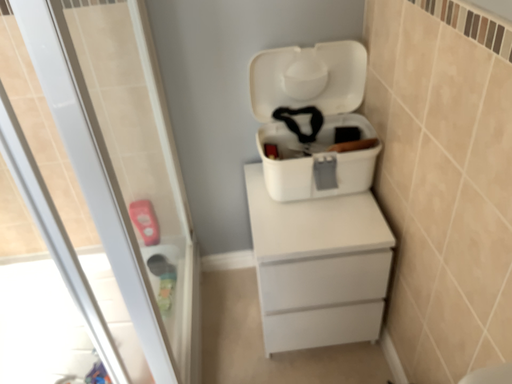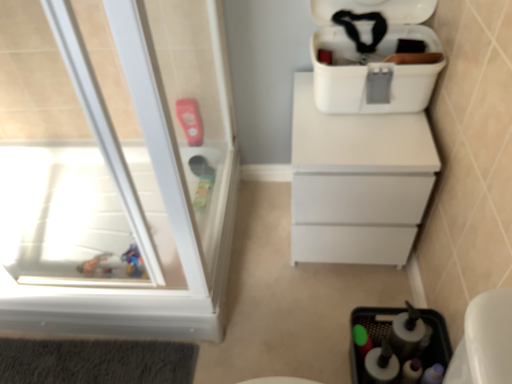
Question: How did the camera likely rotate when shooting the video?

Choices:
 (A) rotated downward
 (B) rotated upward

Answer: (A)